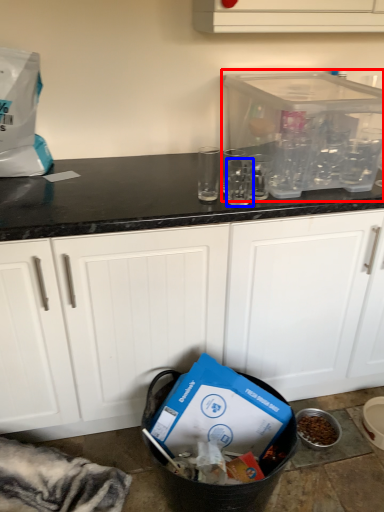
Question: Which object appears closest to the camera in this image, appliance (highlighted by a red box) or clear (highlighted by a blue box)?

Choices:
 (A) appliance
 (B) clear

Answer: (A)